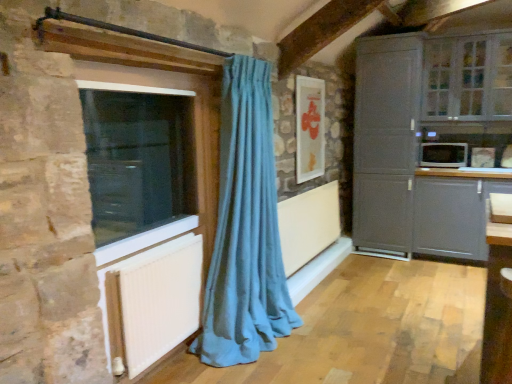
Question: Does matte gray cabinet at right have a lesser width compared to white textured radiator at lower left?

Choices:
 (A) no
 (B) yes

Answer: (A)

Question: Could white textured radiator at lower left be considered to be inside matte gray cabinet at right?

Choices:
 (A) no
 (B) yes

Answer: (A)

Question: Can you confirm if matte gray cabinet at right is smaller than white textured radiator at lower left?

Choices:
 (A) yes
 (B) no

Answer: (B)

Question: Is matte gray cabinet at right shorter than white textured radiator at lower left?

Choices:
 (A) yes
 (B) no

Answer: (B)

Question: Is matte gray cabinet at right bigger than white textured radiator at lower left?

Choices:
 (A) no
 (B) yes

Answer: (B)

Question: From a real-world perspective, is matte gray cabinet at right physically below white textured radiator at lower left?

Choices:
 (A) no
 (B) yes

Answer: (A)

Question: Can you confirm if clear glass cabinet at upper right, which appears as the first window when viewed from the right, is positioned to the left of transparent glass window at left, positioned as the first window in left-to-right order?

Choices:
 (A) yes
 (B) no

Answer: (B)

Question: Is clear glass cabinet at upper right, arranged as the second window when ordered from the bottom, positioned in front of transparent glass window at left, which ranks as the 2th window in right-to-left order?

Choices:
 (A) yes
 (B) no

Answer: (B)

Question: Is clear glass cabinet at upper right, the first window in the top-to-bottom sequence, not close to transparent glass window at left, the 2th window viewed from the top?

Choices:
 (A) yes
 (B) no

Answer: (A)

Question: Does clear glass cabinet at upper right, which appears as the first window when viewed from the right, have a larger size compared to transparent glass window at left, which ranks as the 2th window in right-to-left order?

Choices:
 (A) no
 (B) yes

Answer: (B)

Question: Is clear glass cabinet at upper right, which appears as the first window when viewed from the right, facing towards transparent glass window at left, positioned as the first window in left-to-right order?

Choices:
 (A) no
 (B) yes

Answer: (B)

Question: Can you confirm if clear glass cabinet at upper right, the first window in the top-to-bottom sequence, is wider than transparent glass window at left, positioned as the first window in left-to-right order?

Choices:
 (A) yes
 (B) no

Answer: (A)

Question: Is the position of transparent glass window at left, which is the 1th window from bottom to top, more distant than that of white glossy microwave at right?

Choices:
 (A) yes
 (B) no

Answer: (B)